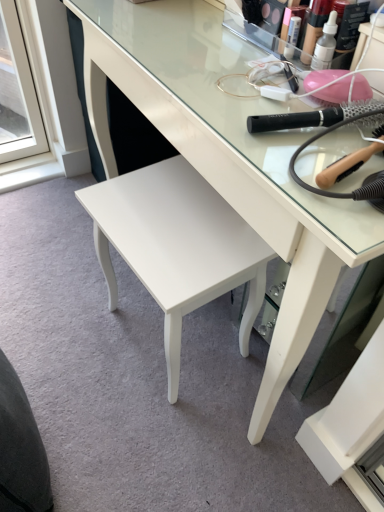
This screenshot has width=384, height=512. Identify the location of free space to the back side of wooden-handled hairbrush at upper right, acting as the 1th brush starting from the bottom. (x=290, y=104).